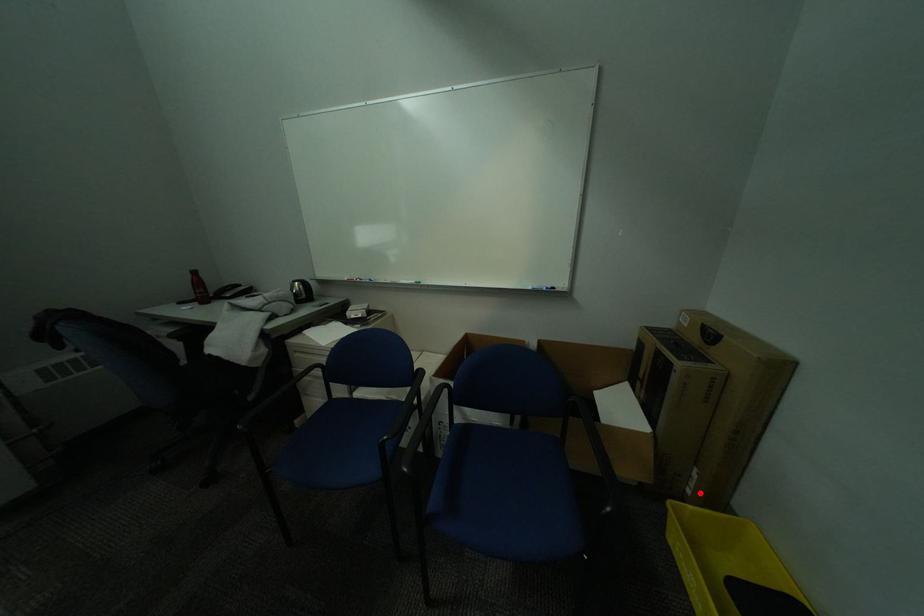
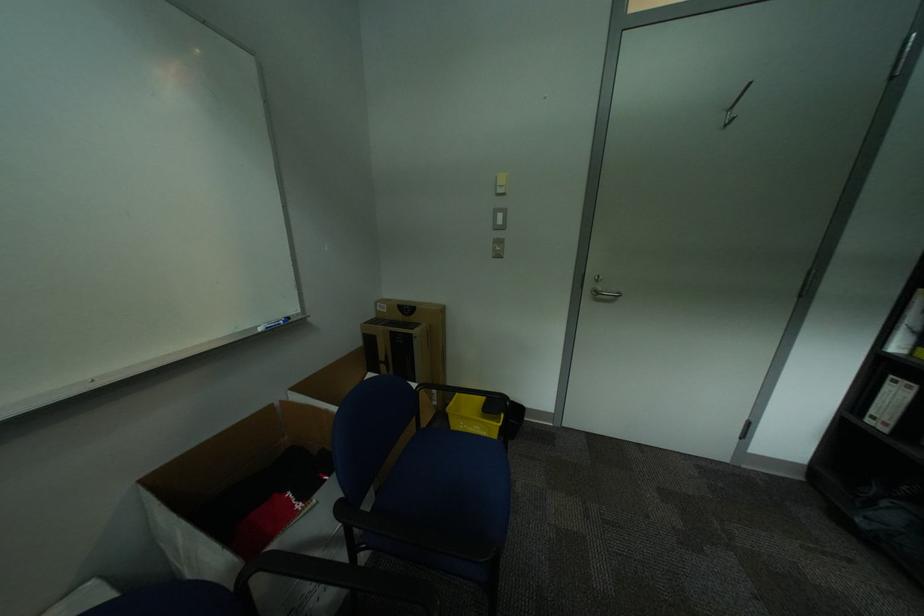
In the second image, find the point that corresponds to the highlighted location in the first image.

(445, 403)